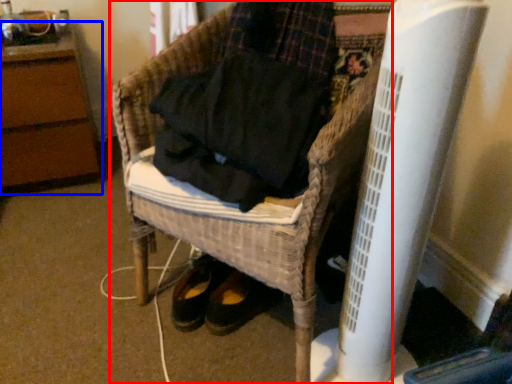
Question: Which object appears farthest to the camera in this image, furniture (highlighted by a red box) or furniture (highlighted by a blue box)?

Choices:
 (A) furniture
 (B) furniture

Answer: (B)